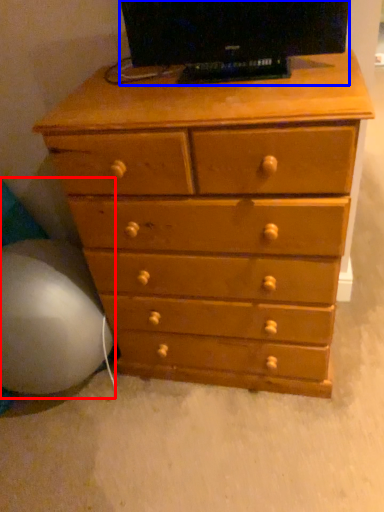
Question: Which object appears farthest to the camera in this image, bean bag chair (highlighted by a red box) or television (highlighted by a blue box)?

Choices:
 (A) bean bag chair
 (B) television

Answer: (A)